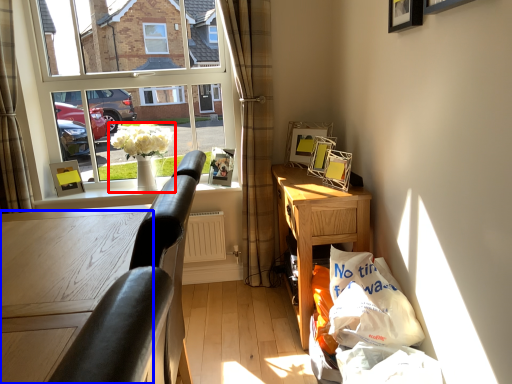
Question: Which object is closer to the camera taking this photo, houseplant (highlighted by a red box) or table (highlighted by a blue box)?

Choices:
 (A) houseplant
 (B) table

Answer: (B)